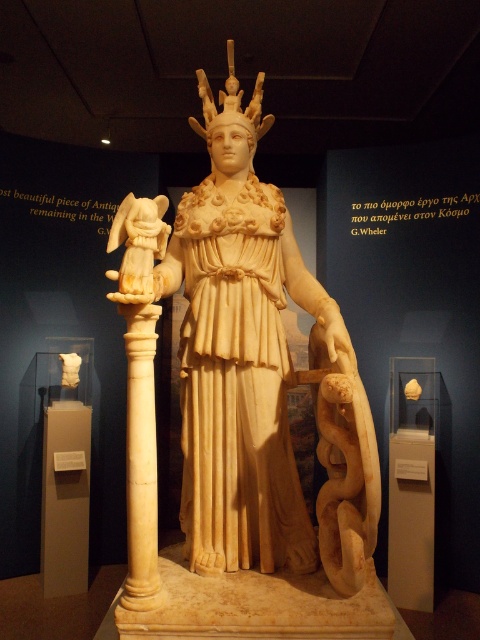
You are a museum curator planning to move the white marble statue at center and the white marble pedestal at lower left to a new exhibition space. The entrance door to the new space has a height restriction of 2 meters. Given that the pedestal is 1.2 meters tall, can both items be moved through the door without any adjustments?

The white marble statue at center is bigger than the white marble pedestal at lower left. Since the pedestal is 1.2 meters tall, the statue must be taller than 1.2 meters. However, the exact height of the statue isn not provided. Therefore, it is uncertain whether the statue exceeds the 2 meter height restriction. Further measurements are needed to determine if adjustments are necessary.

You are a tour guide explaining the layout of the museum exhibit. Pointing to the white marble statue at center and the white marble pedestal at lower left, you want to describe their positions relative to each other. How would you phrase this?

The white marble statue at center is positioned to the right of the white marble pedestal at lower left.

You are a museum curator planning to install a protective barrier around the white marble statue at center and the white marble pedestal at lower left. The barrier needs to be placed exactly 3 feet away from both objects. Is this possible given their current positions?

The distance between the white marble statue at center and the white marble pedestal at lower left is 4.31 feet. To place the barrier 3 feet away from both, the total required distance would need to be at least 6 feet. Since 4.31 feet is less than 6 feet, it is not possible to position the barrier 3 feet away from both objects simultaneously.